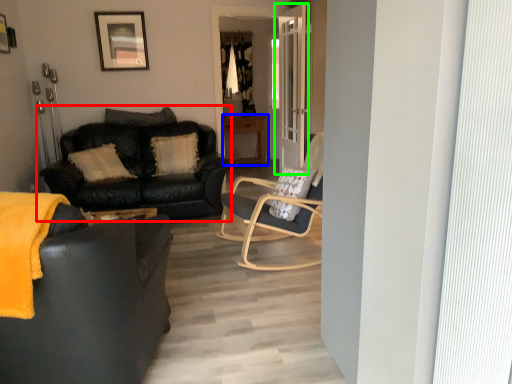
Question: Which object is positioned farthest from studio couch (highlighted by a red box)? Select from table (highlighted by a blue box) and door (highlighted by a green box).

Choices:
 (A) table
 (B) door

Answer: (A)